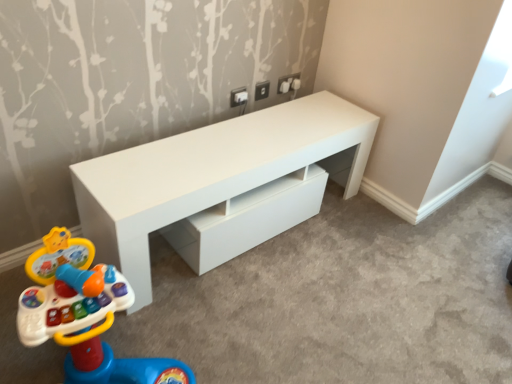
In order to click on free space in front of white glossy table at center in this screenshot , I will do `click(271, 309)`.